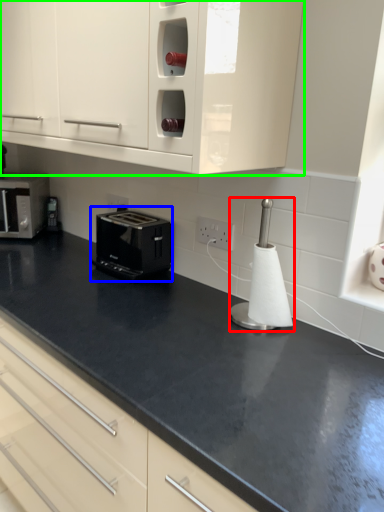
Question: Based on their relative distances, which object is farther from appliance (highlighted by a red box)? Choose from toaster (highlighted by a blue box) and cabinetry (highlighted by a green box).

Choices:
 (A) toaster
 (B) cabinetry

Answer: (A)